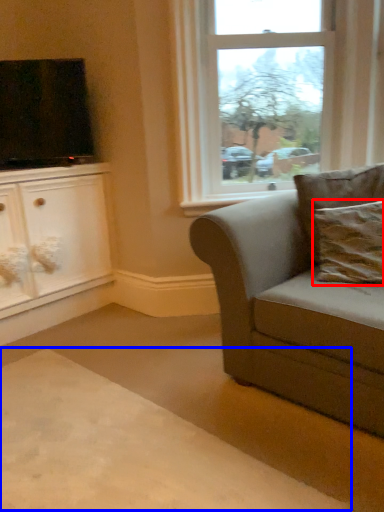
Question: Which of the following is the closest to the observer, pillow (highlighted by a red box) or plain (highlighted by a blue box)?

Choices:
 (A) pillow
 (B) plain

Answer: (B)